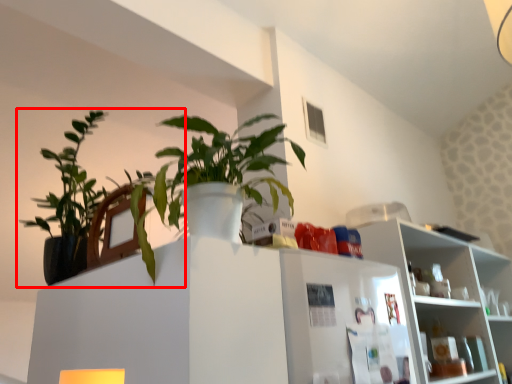
Question: From the image's perspective, where is houseplant (annotated by the red box) located in relation to shelf in the image?

Choices:
 (A) above
 (B) below

Answer: (A)